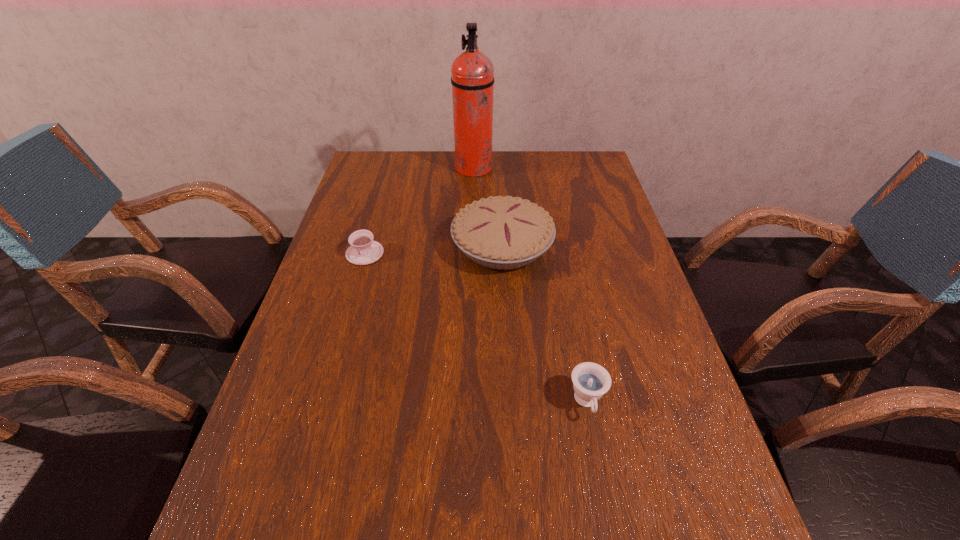
Identify the location of unoccupied area between the farthest object and the farther teacup. Image resolution: width=960 pixels, height=540 pixels. (420, 211).

Locate an element on the screen. Image resolution: width=960 pixels, height=540 pixels. free spot between the shorter teacup and the second tallest object is located at coordinates pyautogui.click(x=434, y=249).

Where is `free area in between the leftmost object and the nearer teacup`? This screenshot has height=540, width=960. free area in between the leftmost object and the nearer teacup is located at coordinates (476, 328).

Identify the location of free space that is in between the pie and the leftmost object. (434, 249).

Locate an element on the screen. This screenshot has height=540, width=960. blank region between the fire extinguisher and the left teacup is located at coordinates (420, 211).

Identify the location of vacant space in between the tallest object and the shorter teacup. (420, 211).

Identify which object is the third closest to the pie. Please provide its 2D coordinates. Your answer should be formatted as a tuple, i.e. [(x, y)], where the tuple contains the x and y coordinates of a point satisfying the conditions above.

[(591, 381)]

Locate which object ranks second in proximity to the fire extinguisher. Please provide its 2D coordinates. Your answer should be formatted as a tuple, i.e. [(x, y)], where the tuple contains the x and y coordinates of a point satisfying the conditions above.

[(363, 250)]

Identify the location of free space that satisfies the following two spatial constraints: 1. at the nozzle of the farthest object; 2. on the right side of the pie. (472, 246).

Locate an element on the screen. This screenshot has height=540, width=960. vacant position in the image that satisfies the following two spatial constraints: 1. at the nozzle of the fire extinguisher; 2. on the handle side of the shortest object is located at coordinates (472, 253).